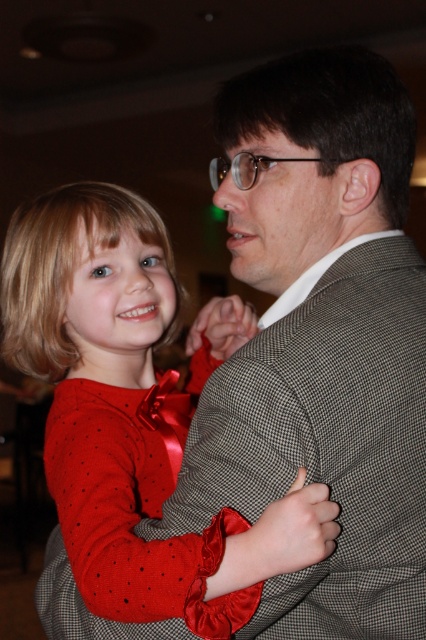
You are at a formal event and need to decide where to place your belongings. You have a red satin dress at center and clear plastic glasses at center. Which item should you place on the higher shelf to ensure proper storage?

The red satin dress at center is taller than the clear plastic glasses at center, so you should place the red satin dress at center on the higher shelf to accommodate its height.